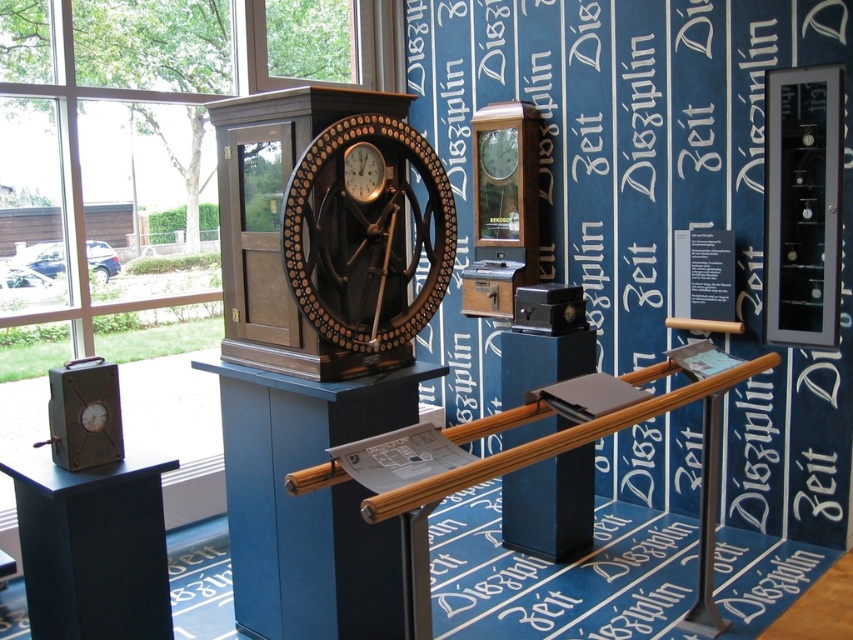
Question: Does blue wood pillar at center appear on the left side of polished brass clock at center?

Choices:
 (A) no
 (B) yes

Answer: (B)

Question: Does blue wood pillar at center appear on the right side of matte brown clock at center?

Choices:
 (A) no
 (B) yes

Answer: (A)

Question: Which object is the closest to the blue wood pillar at center?

Choices:
 (A) matte black panel at center
 (B) matte brown clock at center

Answer: (B)

Question: Which point is farther from the camera taking this photo?

Choices:
 (A) (422, 145)
 (B) (503, 342)
 (C) (326, 534)
 (D) (363, 160)

Answer: (B)

Question: Can you confirm if polished brass clock at center is bigger than matte brown clock at center?

Choices:
 (A) yes
 (B) no

Answer: (A)

Question: Which object is farther from the camera taking this photo?

Choices:
 (A) blue wood pillar at center
 (B) polished brass clock at center
 (C) matte black panel at center
 (D) matte brown clock at center

Answer: (C)